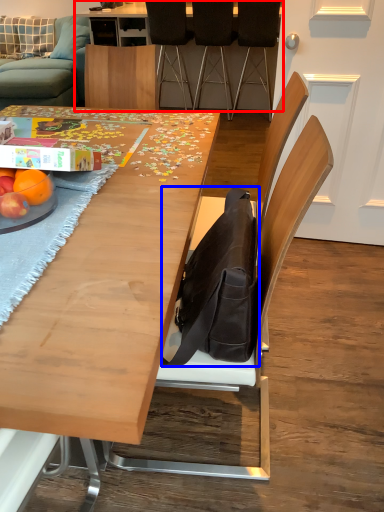
Question: Which of the following is the closest to the observer, table (highlighted by a red box) or messenger bag (highlighted by a blue box)?

Choices:
 (A) table
 (B) messenger bag

Answer: (B)